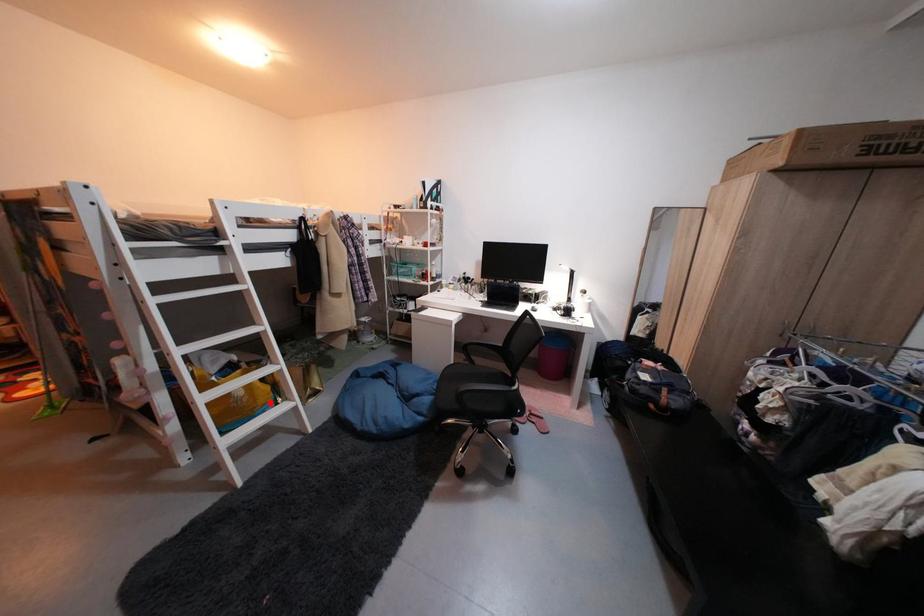
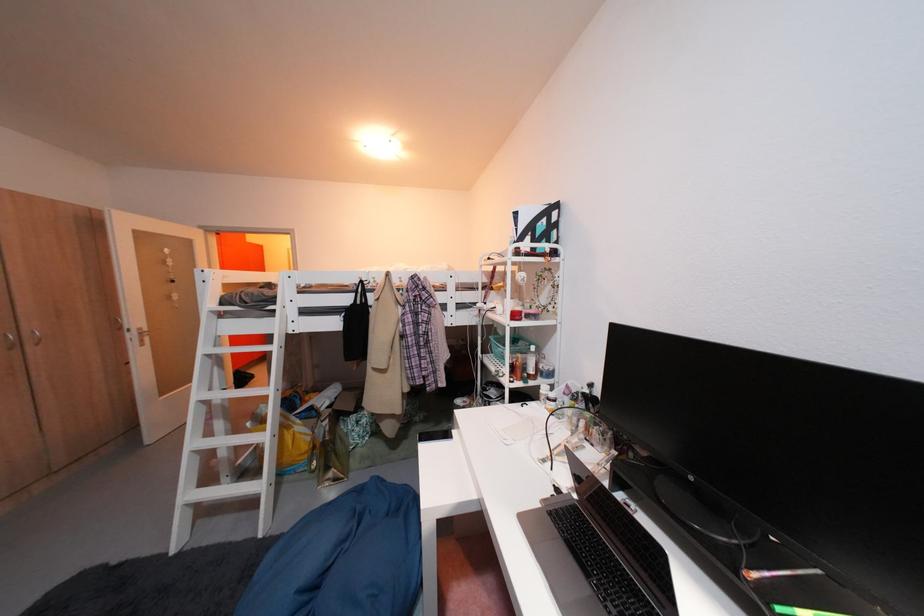
Locate, in the second image, the point that corresponds to the highlighted location in the first image.

(296, 461)